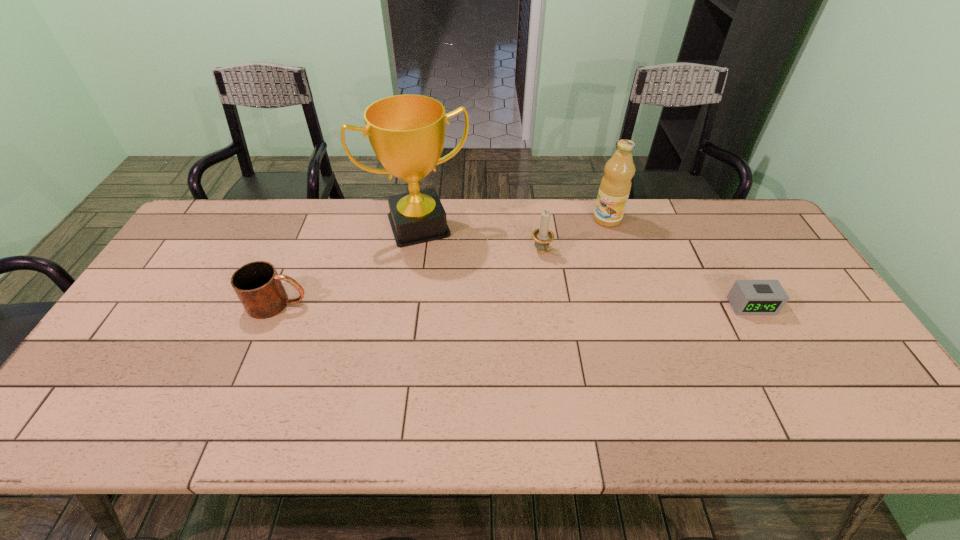
The width and height of the screenshot is (960, 540). In order to click on vacant space located 0.380m on the label of the olive oil in this screenshot , I will do `click(533, 292)`.

I want to click on award at the far edge, so click(x=407, y=132).

The height and width of the screenshot is (540, 960). In order to click on candle_holder located at the far edge in this screenshot , I will do `click(542, 236)`.

The width and height of the screenshot is (960, 540). In order to click on olive oil located at the far edge in this screenshot , I will do `click(615, 186)`.

This screenshot has width=960, height=540. Find the location of `object positioned at the right edge`. object positioned at the right edge is located at coordinates (747, 297).

At what (x,y) coordinates should I click in order to perform the action: click on vacant space at the far edge. Please return your answer as a coordinate pair (x, y). This screenshot has height=540, width=960. Looking at the image, I should click on (591, 242).

What are the coordinates of `vacant space at the near edge of the desktop` in the screenshot? It's located at (452, 367).

This screenshot has width=960, height=540. In order to click on vacant area at the left edge in this screenshot , I will do (x=221, y=257).

Locate an element on the screen. free spot at the right edge of the desktop is located at coordinates (735, 251).

Find the location of a particular element. free space at the far right corner is located at coordinates click(x=744, y=237).